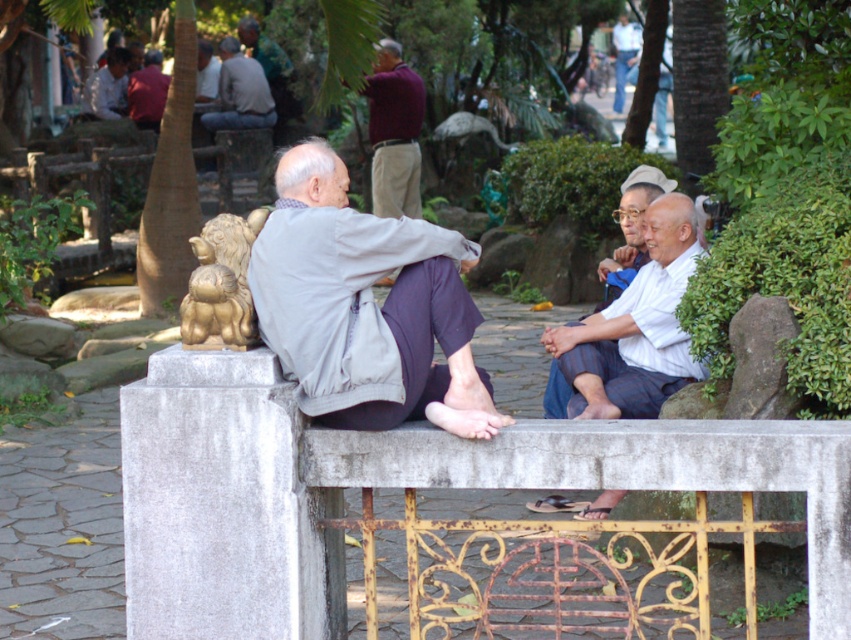
You are a photographer trying to capture a shot of the matte red shirt at upper left and the white striped fabric at right. Based on their positions, which object is located to the right of the other?

The white striped fabric at right is to the right of the matte red shirt at upper left.

You are standing at the golden lion statue and want to take a photo of both the point at coordinates (249, 243) and the point at coordinates (143, 99). Which point will appear larger in your camera view?

Point at coordinates (249, 243) will appear larger in the camera view because it is closer to the camera than point at coordinates (143, 99).

You are standing at the center of the park and see the point marked as (221, 285). What does this point represent?

The point marked as (221, 285) represents the location of the gold polished statue at left.